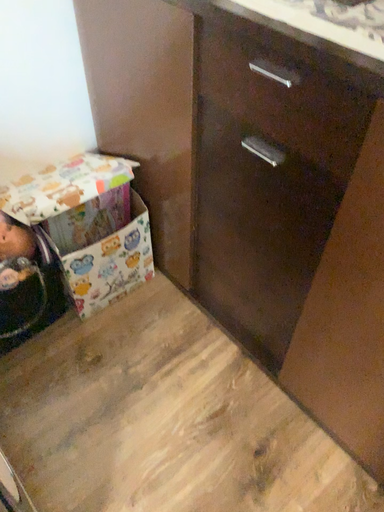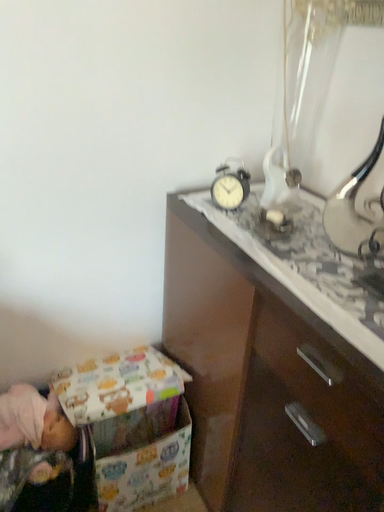
Question: Which way did the camera rotate in the video?

Choices:
 (A) rotated downward
 (B) rotated upward

Answer: (B)